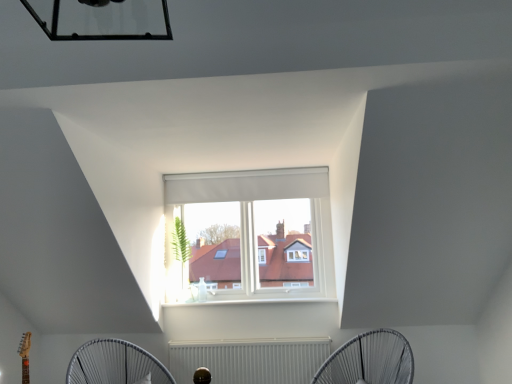
Question: Does point (148, 380) appear closer or farther from the camera than point (206, 365)?

Choices:
 (A) closer
 (B) farther

Answer: (A)

Question: From the image's perspective, is white wireframe fan at lower center, the second mechanical fan from the right, located above or below white textured radiator at lower center?

Choices:
 (A) below
 (B) above

Answer: (B)

Question: Which object is the closest to the white textured radiator at lower center?

Choices:
 (A) white wireframe fan at lower center, marked as the 1th mechanical fan in a left-to-right arrangement
 (B) white fabric mechanical fan at lower center, the first mechanical fan from the right

Answer: (B)

Question: Which is nearer to the white wireframe fan at lower center, marked as the 1th mechanical fan in a left-to-right arrangement?

Choices:
 (A) white textured radiator at lower center
 (B) white fabric mechanical fan at lower center, the second mechanical fan when ordered from left to right

Answer: (A)